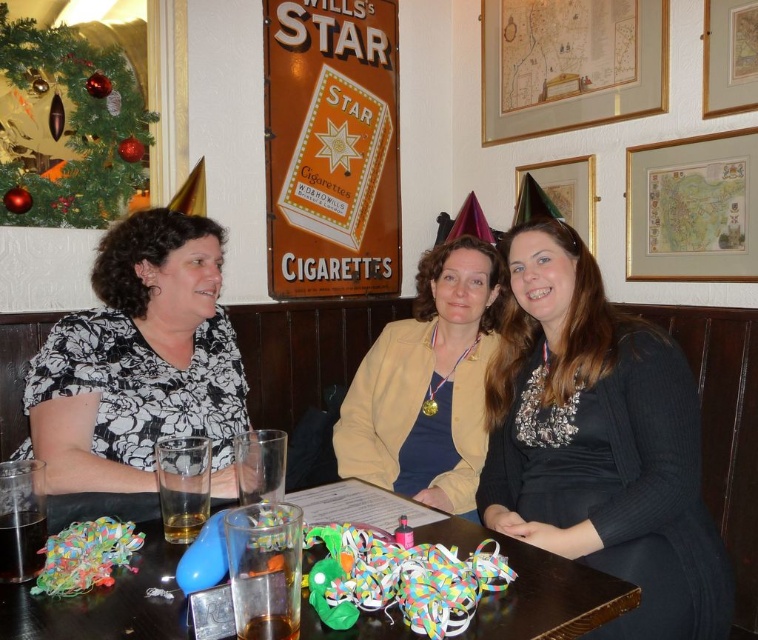
In the scene shown: You are a photographer standing at the camera position. You want to take a closeup shot of the matte gold medal at center. Can you reach it with your hand to adjust its position without moving your body? Please explain your reasoning.

The matte gold medal at center is 5.90 feet from the camera. Since the average human arm length is about 2.5 feet, you cannot reach it without moving your body.

You are a bartender at this vintage pub. You need to place a new drink order on the table where the translucent plastic cups at center and multicolored paper streamers at table center are located. Considering their heights, where should you place the new drink to avoid blocking the view of the streamers?

Since the translucent plastic cups at center are not as tall as the multicolored paper streamers at table center, you should place the new drink near the translucent plastic cups at center to ensure the shorter cups don not block the view of the taller streamers.